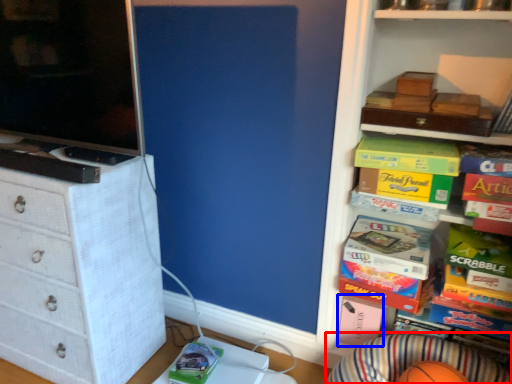
Question: Among these objects, which one is nearest to the camera, plain (highlighted by a red box) or box (highlighted by a blue box)?

Choices:
 (A) plain
 (B) box

Answer: (A)